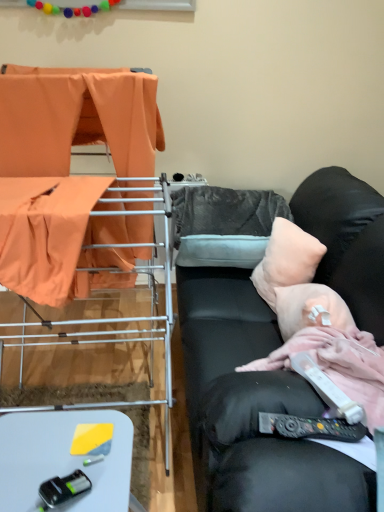
This screenshot has width=384, height=512. I want to click on vacant space to the right of black plastic toy car at lower left, which is the 1th equipment in left-to-right order, so click(x=104, y=487).